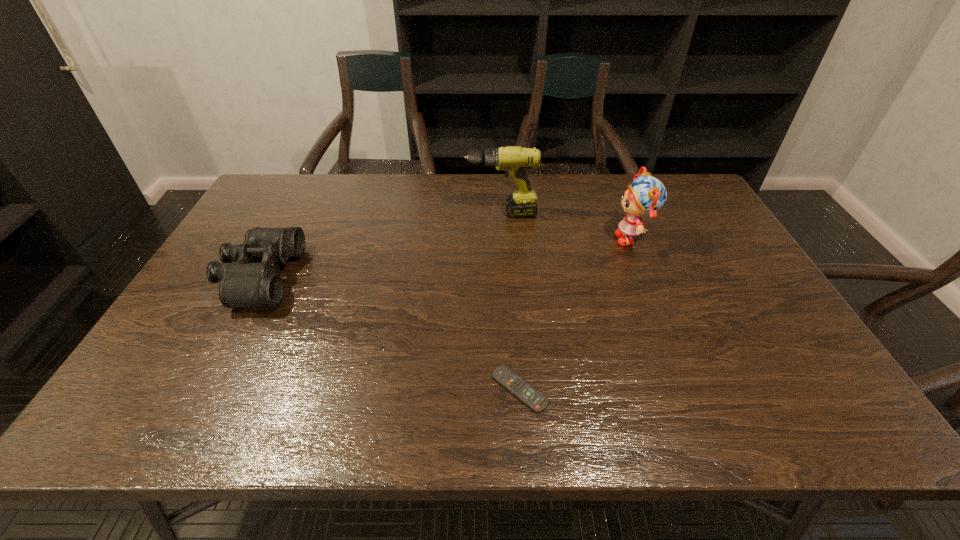
Identify the location of blank space located 0.330m on the face of the rightmost object. (505, 239).

The height and width of the screenshot is (540, 960). I want to click on vacant space located 0.290m on the face of the rightmost object, so click(517, 239).

Identify the location of free space located 0.210m at the eyepieces of the leftmost object. (370, 277).

Find the location of `free region located 0.290m on the right of the nearest object`. free region located 0.290m on the right of the nearest object is located at coordinates (680, 390).

Locate an element on the screen. This screenshot has width=960, height=540. object that is at the far edge is located at coordinates (514, 160).

This screenshot has width=960, height=540. What are the coordinates of `object at the near edge` in the screenshot? It's located at (537, 402).

This screenshot has width=960, height=540. Identify the location of object at the left edge. (253, 279).

Find the location of a particular element. This screenshot has width=960, height=540. vacant region at the far edge of the desktop is located at coordinates (625, 177).

Where is `free location at the near edge of the desktop`? The width and height of the screenshot is (960, 540). free location at the near edge of the desktop is located at coordinates (626, 407).

At what (x,y) coordinates should I click in order to perform the action: click on free space at the left edge. Please return your answer as a coordinate pair (x, y). Looking at the image, I should click on 250,225.